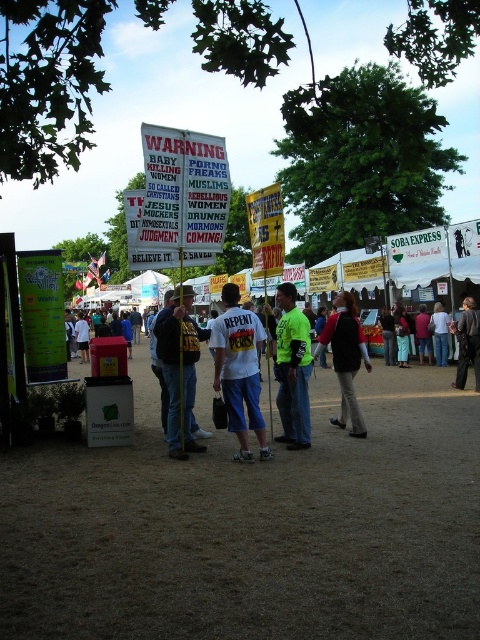
Question: Which of the following is the farthest from the observer?

Choices:
 (A) light blue jeans at center
 (B) dark gray suit at center
 (C) dark red shirt at center
 (D) brown dirt field at center

Answer: (A)

Question: Where is denim jeans at center located in relation to dark gray suit at center in the image?

Choices:
 (A) left
 (B) right

Answer: (A)

Question: Which point is closer to the camera taking this photo?

Choices:
 (A) (429, 620)
 (B) (432, 326)
 (C) (217, 385)

Answer: (A)

Question: Does neon green shirt at center have a greater width compared to dark gray suit at center?

Choices:
 (A) no
 (B) yes

Answer: (A)

Question: Which point appears closest to the camera in this image?

Choices:
 (A) (340, 323)
 (B) (213, 486)

Answer: (B)

Question: Can you confirm if neon green shirt at center is thinner than light blue jeans at center?

Choices:
 (A) no
 (B) yes

Answer: (B)